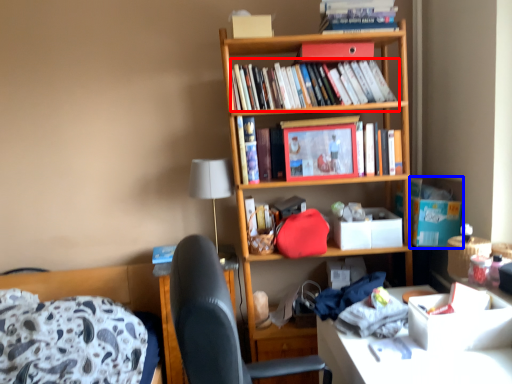
Question: Which point is closer to the camera, book (highlighted by a red box) or cardboard box (highlighted by a blue box)?

Choices:
 (A) book
 (B) cardboard box

Answer: (A)